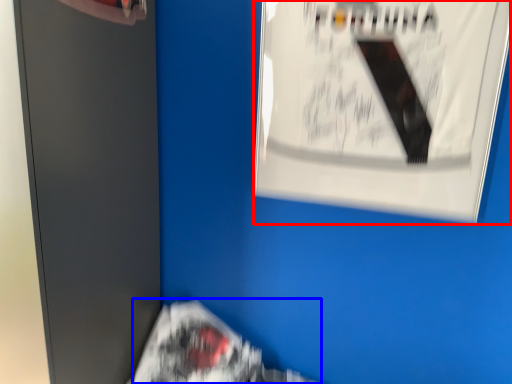
Question: Among these objects, which one is nearest to the camera, poster (highlighted by a red box) or flyer (highlighted by a blue box)?

Choices:
 (A) poster
 (B) flyer

Answer: (A)